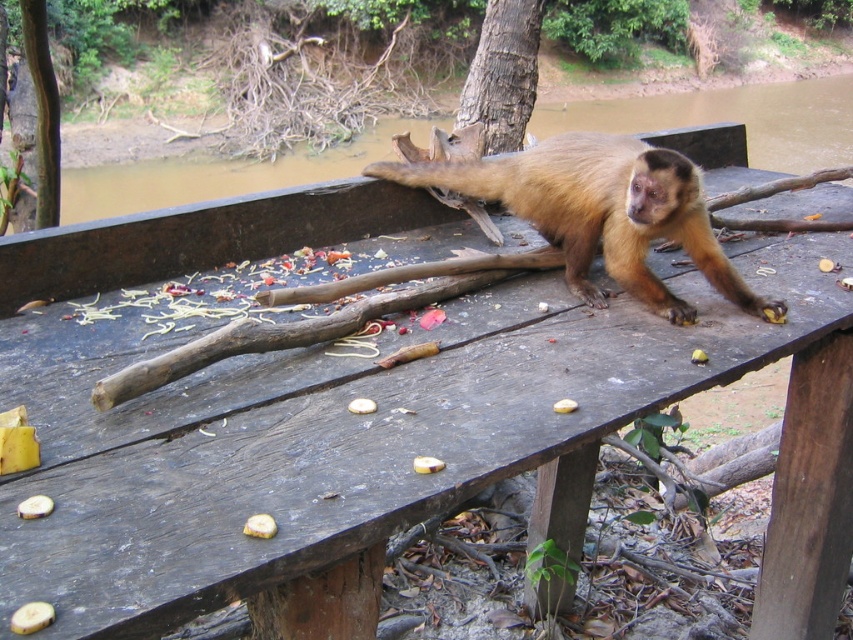
You are a researcher studying the behavior of monkeys in their natural habitat. You observe a monkey on the right side of a weathered wooden table with scattered fruit peels and seeds. There is also a yellow matte fruit at center. Based on the monkey reaching towards the fruit, can you determine the direction the monkey is facing?

The yellow matte fruit at center is located at point [32,618]. Since the monkey is on the right side of the table and reaching towards the fruit, it is facing towards the center of the table where the fruit is placed.

You are a small bird looking for a place to perch. You see the brown rough bark tree at upper center and the yellow matte banana at lower left. Which object is larger and would provide a more stable perch?

The brown rough bark tree at upper center is bigger than the yellow matte banana at lower left, so it would provide a more stable perch.